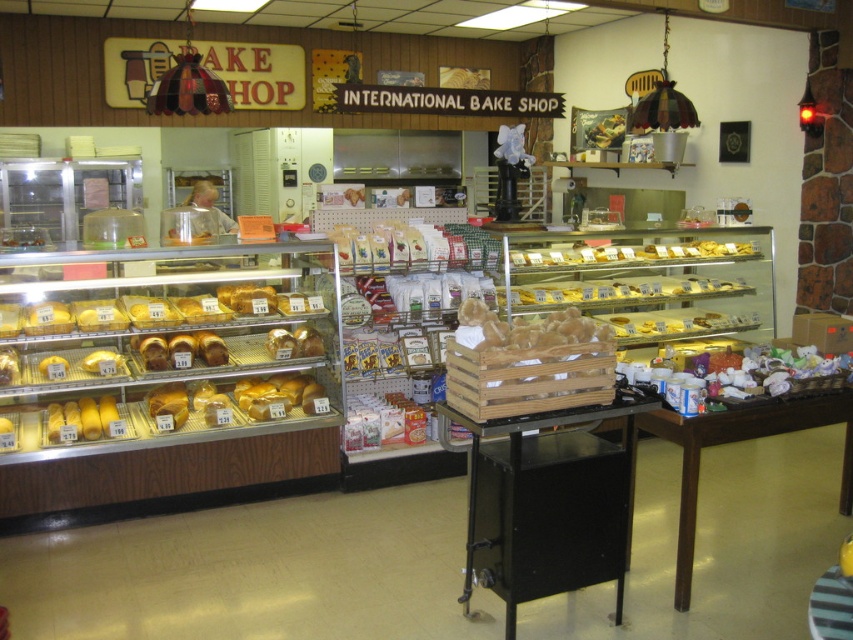
Question: Is black metal table at center smaller than brown wooden table at lower right?

Choices:
 (A) no
 (B) yes

Answer: (B)

Question: Which point appears closest to the camera in this image?

Choices:
 (A) (843, 477)
 (B) (503, 445)

Answer: (B)

Question: Which object appears closest to the camera in this image?

Choices:
 (A) black metal table at center
 (B) brown wooden table at lower right

Answer: (A)

Question: Does black metal table at center lie in front of brown wooden table at lower right?

Choices:
 (A) yes
 (B) no

Answer: (A)

Question: Is black metal table at center above brown wooden table at lower right?

Choices:
 (A) no
 (B) yes

Answer: (B)